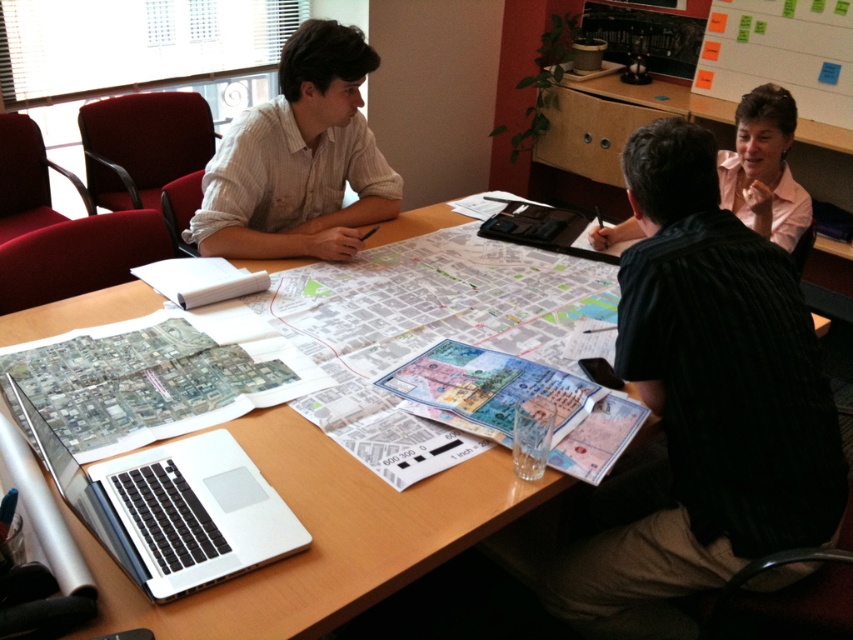
Question: Which point is closer to the camera taking this photo?

Choices:
 (A) (338, 614)
 (B) (119, 470)
 (C) (767, 451)

Answer: (A)

Question: Is white striped shirt at upper left below silver metallic laptop at lower left?

Choices:
 (A) no
 (B) yes

Answer: (A)

Question: In this image, where is white striped shirt at upper left located relative to transparent plastic map at lower left?

Choices:
 (A) below
 (B) above

Answer: (B)

Question: Based on their relative distances, which object is farther from the transparent plastic map at lower left?

Choices:
 (A) silver metallic laptop at lower left
 (B) wooden table at center
 (C) pink fabric shirt at upper right
 (D) black velvet shirt at center

Answer: (C)

Question: Does silver metallic laptop at lower left have a greater width compared to pink fabric shirt at upper right?

Choices:
 (A) yes
 (B) no

Answer: (A)

Question: Estimate the real-world distances between objects in this image. Which object is closer to the transparent plastic map at center?

Choices:
 (A) silver metallic laptop at lower left
 (B) pink fabric shirt at upper right
 (C) black matte laptop at center
 (D) wooden table at center

Answer: (D)